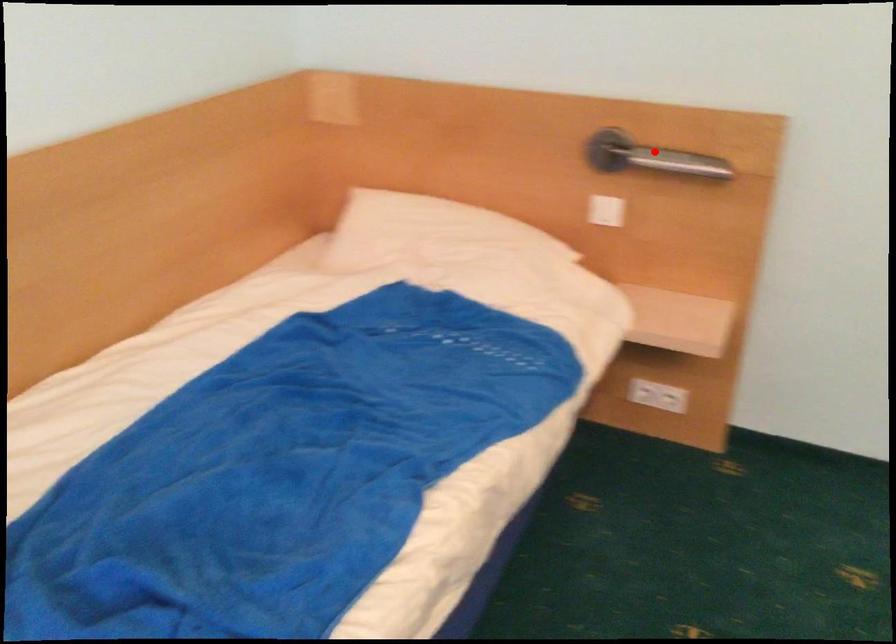
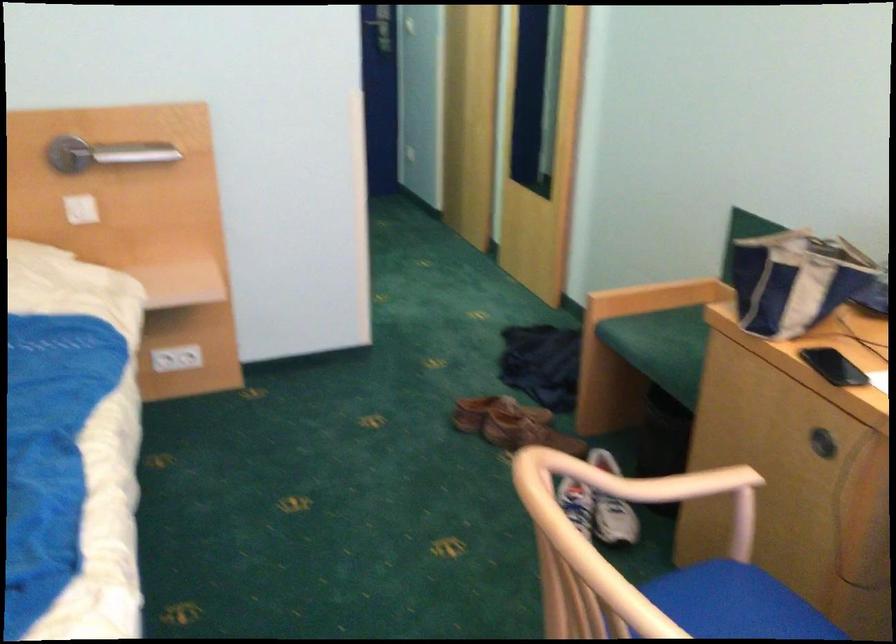
Locate, in the second image, the point that corresponds to the highlighted location in the first image.

(105, 154)